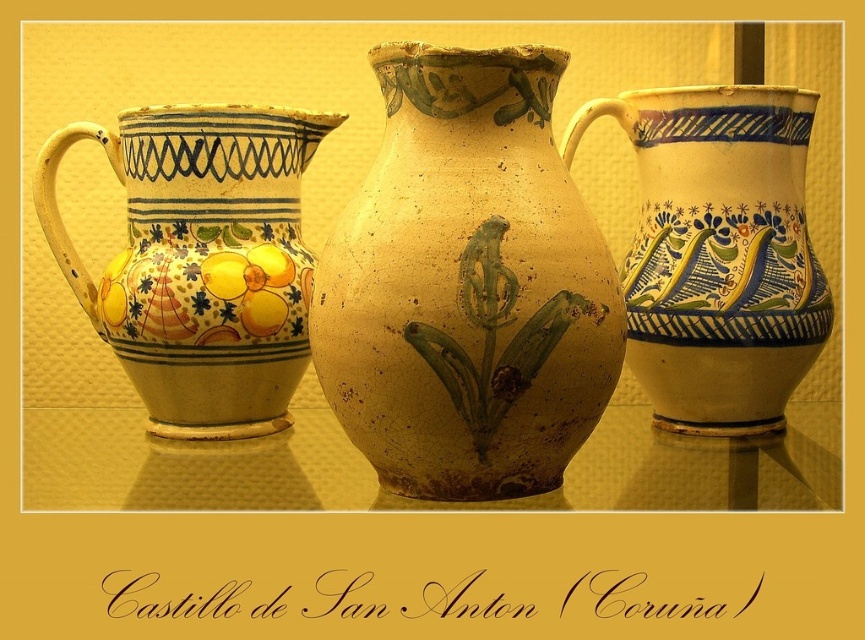
Question: Which point is farther to the camera?

Choices:
 (A) (780, 336)
 (B) (264, 136)

Answer: (B)

Question: Which point is closer to the camera taking this photo?

Choices:
 (A) (311, 129)
 (B) (423, 227)

Answer: (B)

Question: Can you confirm if earthenware vase at center is bigger than matte ceramic jug at left?

Choices:
 (A) yes
 (B) no

Answer: (A)

Question: Does earthenware vase at center come in front of matte yellow jug at center?

Choices:
 (A) yes
 (B) no

Answer: (A)

Question: Does earthenware vase at center lie behind matte ceramic jug at left?

Choices:
 (A) no
 (B) yes

Answer: (A)

Question: Among these points, which one is farthest from the camera?

Choices:
 (A) (375, 204)
 (B) (248, 284)
 (C) (734, 326)

Answer: (B)